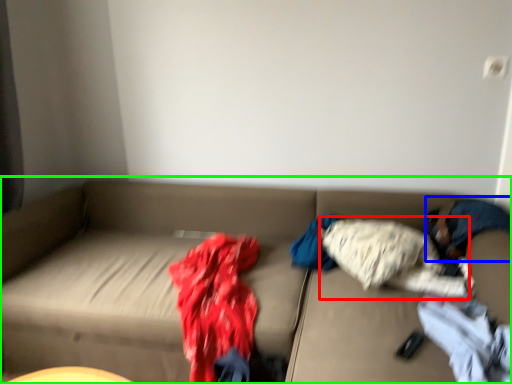
Question: Which is farther away from clothing (highlighted by a red box)? person (highlighted by a blue box) or studio couch (highlighted by a green box)?

Choices:
 (A) person
 (B) studio couch

Answer: (B)